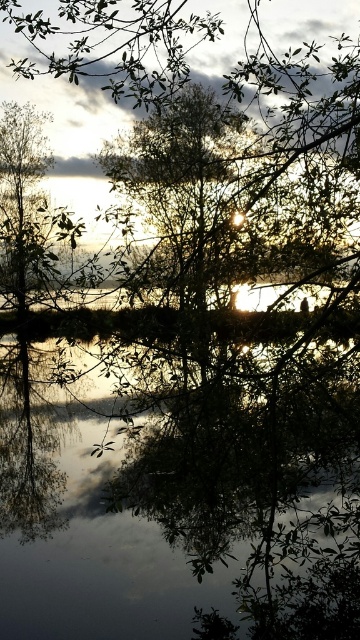
Question: Where is green leafy tree at center located in relation to silvery metallic tree at left in the image?

Choices:
 (A) left
 (B) right

Answer: (B)

Question: Which point appears farthest from the camera in this image?

Choices:
 (A) (41, 273)
 (B) (186, 1)
 (C) (141, 624)

Answer: (C)

Question: Which of the following is the farthest from the observer?

Choices:
 (A) (10, 301)
 (B) (213, 368)

Answer: (A)

Question: Is green leafy tree at center to the right of silvery metallic tree at left from the viewer's perspective?

Choices:
 (A) no
 (B) yes

Answer: (B)

Question: Which point is farther from the camera taking this photo?

Choices:
 (A) (214, 561)
 (B) (9, 234)

Answer: (B)

Question: Does transparent water at center appear under green leafy tree at center?

Choices:
 (A) yes
 (B) no

Answer: (A)